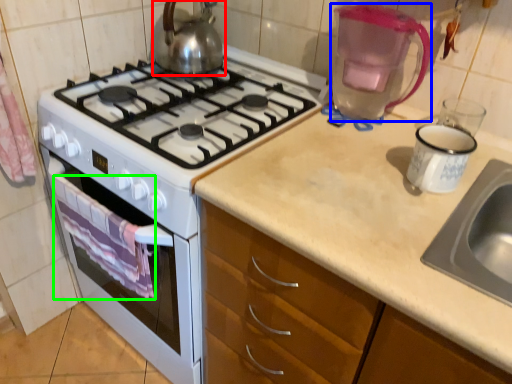
Question: Estimate the real-world distances between objects in this image. Which object is farther from kettle (highlighted by a red box), coffeepot (highlighted by a blue box) or cloth (highlighted by a green box)?

Choices:
 (A) coffeepot
 (B) cloth

Answer: (B)